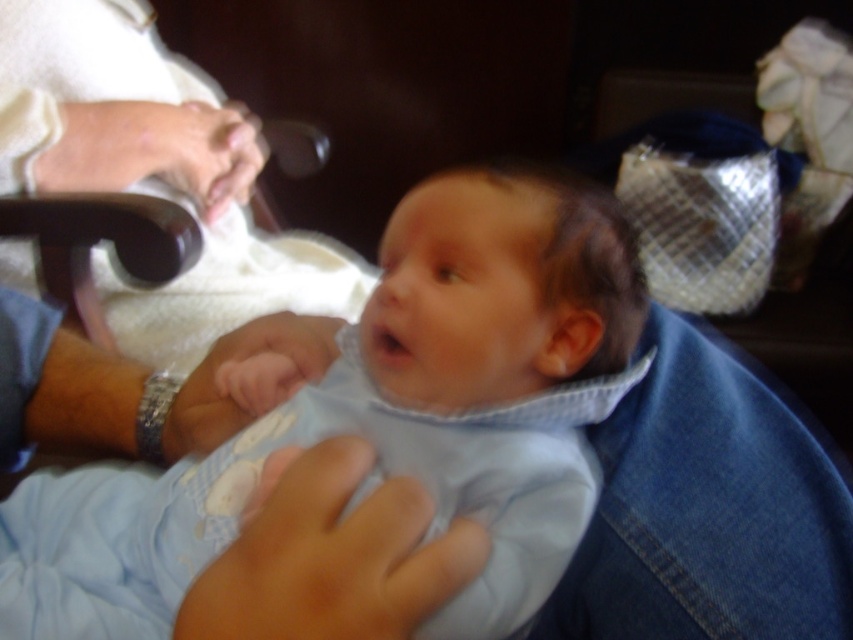
Question: Can you confirm if smooth skin hand at center is thinner than metallic wristwatch at lower left?

Choices:
 (A) no
 (B) yes

Answer: (B)

Question: Estimate the real-world distances between objects in this image. Which object is farther from the light blue fabric at center?

Choices:
 (A) light blue quilted fabric at center
 (B) matte plastic glasses at upper left
 (C) metallic wristwatch at lower left

Answer: (B)

Question: Is smooth skin hand at center thinner than metallic wristwatch at lower left?

Choices:
 (A) no
 (B) yes

Answer: (B)

Question: Does light blue quilted fabric at center come behind smooth skin at upper left?

Choices:
 (A) no
 (B) yes

Answer: (A)

Question: Which of these objects is positioned farthest from the smooth skin at upper left?

Choices:
 (A) light blue fabric at center
 (B) smooth skin hand at center
 (C) metallic wristwatch at lower left

Answer: (B)

Question: Which object appears farthest from the camera in this image?

Choices:
 (A) light blue fabric at center
 (B) matte plastic glasses at upper left

Answer: (B)